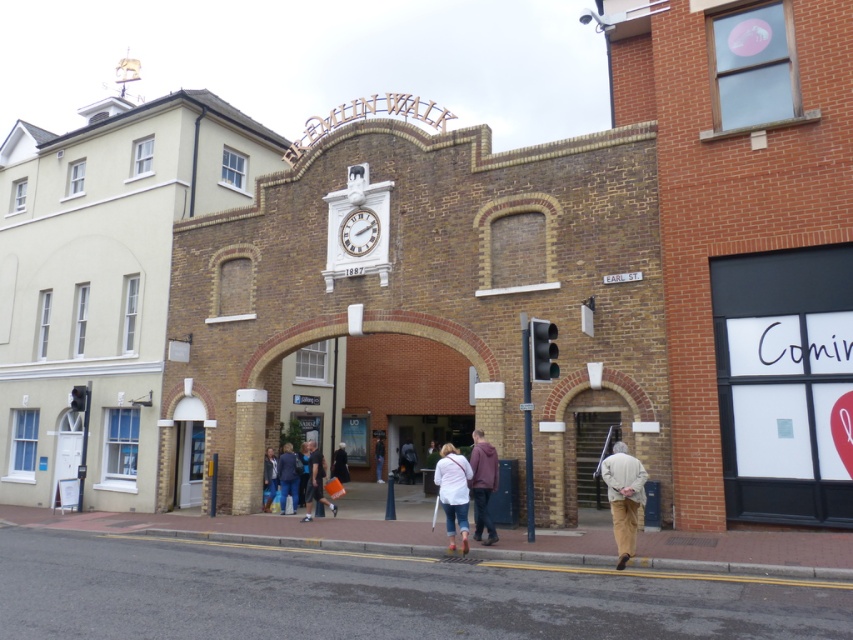
Question: Which of the following is the closest to the observer?

Choices:
 (A) (479, 445)
 (B) (409, 461)
 (C) (630, 509)

Answer: (C)

Question: In this image, where is dark gray fabric jacket at center located relative to dark blue jacket at center?

Choices:
 (A) left
 (B) right

Answer: (A)

Question: Estimate the real-world distances between objects in this image. Which object is farther from the denim jacket at center?

Choices:
 (A) light brown leather jacket at center
 (B) light brown corduroy pants at lower right

Answer: (B)

Question: Which point is farther to the camera?

Choices:
 (A) (349, 216)
 (B) (477, 440)
 (C) (611, 504)
 (D) (401, 452)

Answer: (D)

Question: Is light brown corduroy pants at lower right above light blue jeans at center?

Choices:
 (A) yes
 (B) no

Answer: (A)

Question: Considering the relative positions of white glossy clock at center and matte black jacket at center in the image provided, where is white glossy clock at center located with respect to matte black jacket at center?

Choices:
 (A) below
 (B) above

Answer: (B)